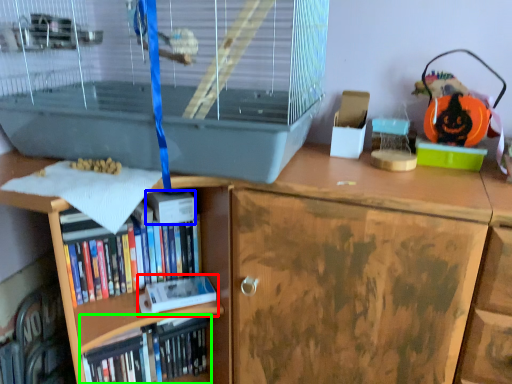
Question: Estimate the real-world distances between objects in this image. Which object is closer to paperback book (highlighted by a red box), paperback book (highlighted by a blue box) or book (highlighted by a green box)?

Choices:
 (A) paperback book
 (B) book

Answer: (B)